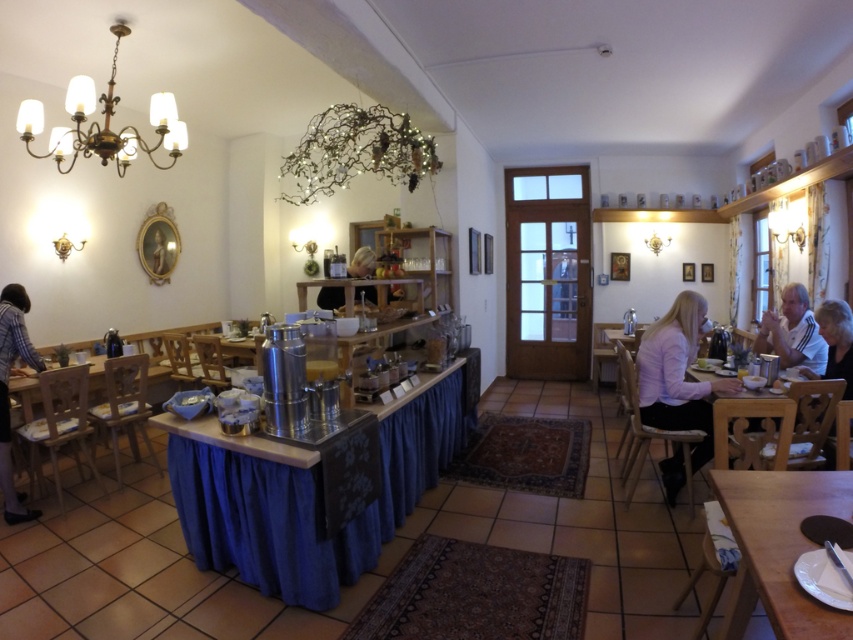
You are standing at the point marked as point (6, 456) in the image. You want to reach the exit located at the opposite corner of the room. The room is 12 feet long. Can you walk straight from your current position to the exit without any obstacles?

The distance between you and the exit is 12 feet minus your current position, but since the objects description states they are 9.62 feet apart, you can walk straight as there are no obstacles mentioned in the scene description.

You are a customer in the cozy cafe and you see the point at coordinates (7, 390). What is the nearest object to that point?

The nearest object to the point at coordinates (7, 390) is the plaid shirt at left.